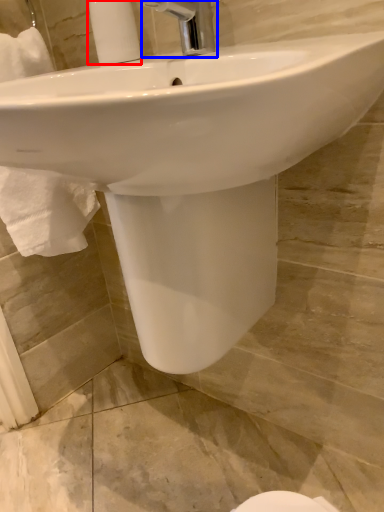
Question: Among these objects, which one is farthest to the camera, soap dispenser (highlighted by a red box) or tap (highlighted by a blue box)?

Choices:
 (A) soap dispenser
 (B) tap

Answer: (A)